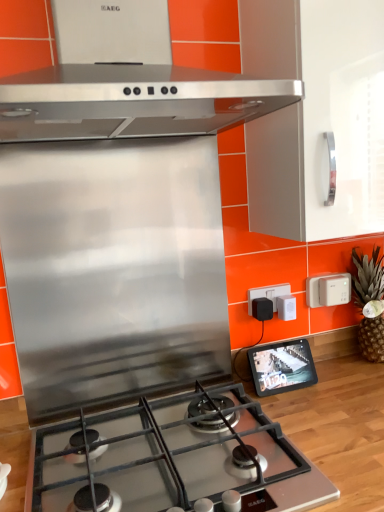
Question: Does green textured pineapple at right have a greater width compared to black plastic at upper right, placed as the first electric outlet when sorted from left to right?

Choices:
 (A) no
 (B) yes

Answer: (B)

Question: Could you tell me if green textured pineapple at right is turned towards black plastic at upper right, the second electric outlet in the right-to-left sequence?

Choices:
 (A) no
 (B) yes

Answer: (A)

Question: Is green textured pineapple at right to the left of black plastic at upper right, placed as the first electric outlet when sorted from left to right, from the viewer's perspective?

Choices:
 (A) no
 (B) yes

Answer: (A)

Question: Is green textured pineapple at right positioned in front of black plastic at upper right, placed as the first electric outlet when sorted from left to right?

Choices:
 (A) no
 (B) yes

Answer: (B)

Question: Can you confirm if green textured pineapple at right is bigger than black plastic at upper right, the second electric outlet in the right-to-left sequence?

Choices:
 (A) yes
 (B) no

Answer: (A)

Question: Is black glossy tablet at right to the left or to the right of stainless steel gas stove at center in the image?

Choices:
 (A) left
 (B) right

Answer: (B)

Question: Is black glossy tablet at right inside or outside of stainless steel gas stove at center?

Choices:
 (A) inside
 (B) outside

Answer: (B)

Question: From their relative heights in the image, would you say black glossy tablet at right is taller or shorter than stainless steel gas stove at center?

Choices:
 (A) tall
 (B) short

Answer: (A)

Question: Is black glossy tablet at right wider or thinner than stainless steel gas stove at center?

Choices:
 (A) thin
 (B) wide

Answer: (A)

Question: Based on their positions, is green textured pineapple at right located to the left or right of black glossy tablet at right?

Choices:
 (A) left
 (B) right

Answer: (B)

Question: From the image's perspective, relative to black glossy tablet at right, is green textured pineapple at right above or below?

Choices:
 (A) below
 (B) above

Answer: (B)

Question: Considering their positions, is green textured pineapple at right located in front of or behind black glossy tablet at right?

Choices:
 (A) behind
 (B) front

Answer: (A)

Question: In terms of height, does green textured pineapple at right look taller or shorter compared to black glossy tablet at right?

Choices:
 (A) tall
 (B) short

Answer: (A)

Question: From the image's perspective, is stainless steel gas stove at center located above or below black plastic at upper right, placed as the first electric outlet when sorted from left to right?

Choices:
 (A) below
 (B) above

Answer: (A)

Question: Relative to black plastic at upper right, placed as the first electric outlet when sorted from left to right, is stainless steel gas stove at center in front or behind?

Choices:
 (A) behind
 (B) front

Answer: (B)